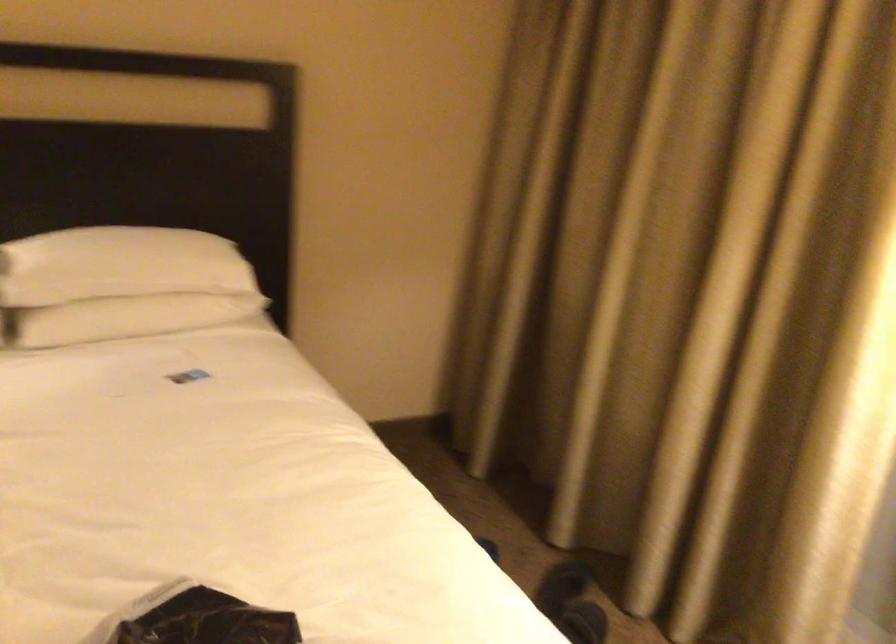
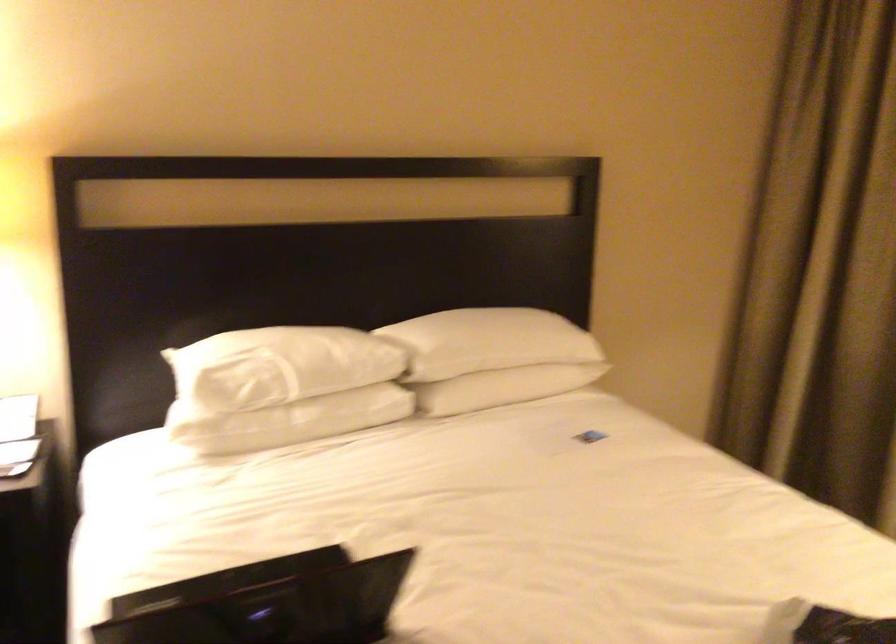
Question: How did the camera likely rotate?

Choices:
 (A) Left
 (B) Right
 (C) Up
 (D) Down

Answer: (A)